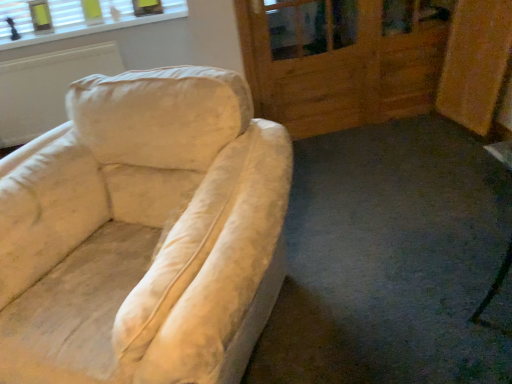
Question: From a real-world perspective, is wooden screen door at upper right located higher than white textured blinds at upper left?

Choices:
 (A) no
 (B) yes

Answer: (A)

Question: From the image's perspective, does wooden screen door at upper right appear lower than white textured blinds at upper left?

Choices:
 (A) no
 (B) yes

Answer: (B)

Question: Is wooden screen door at upper right not close to white textured blinds at upper left?

Choices:
 (A) yes
 (B) no

Answer: (A)

Question: Does wooden screen door at upper right come behind white textured blinds at upper left?

Choices:
 (A) no
 (B) yes

Answer: (A)

Question: Is wooden screen door at upper right facing away from white textured blinds at upper left?

Choices:
 (A) yes
 (B) no

Answer: (B)

Question: From a real-world perspective, is wooden screen door at upper right beneath white textured blinds at upper left?

Choices:
 (A) no
 (B) yes

Answer: (B)

Question: Considering the relative sizes of white textured blinds at upper left and wooden screen door at upper right in the image provided, is white textured blinds at upper left bigger than wooden screen door at upper right?

Choices:
 (A) no
 (B) yes

Answer: (A)

Question: Is white textured blinds at upper left closer to the viewer compared to wooden screen door at upper right?

Choices:
 (A) no
 (B) yes

Answer: (A)

Question: Is white textured blinds at upper left oriented away from wooden screen door at upper right?

Choices:
 (A) no
 (B) yes

Answer: (A)

Question: Does white textured blinds at upper left have a smaller size compared to wooden screen door at upper right?

Choices:
 (A) yes
 (B) no

Answer: (A)

Question: Considering the relative sizes of white textured blinds at upper left and wooden screen door at upper right in the image provided, is white textured blinds at upper left shorter than wooden screen door at upper right?

Choices:
 (A) no
 (B) yes

Answer: (B)

Question: Is white textured blinds at upper left not inside wooden screen door at upper right?

Choices:
 (A) no
 (B) yes

Answer: (B)

Question: Is point (74, 34) closer or farther from the camera than point (327, 56)?

Choices:
 (A) farther
 (B) closer

Answer: (A)